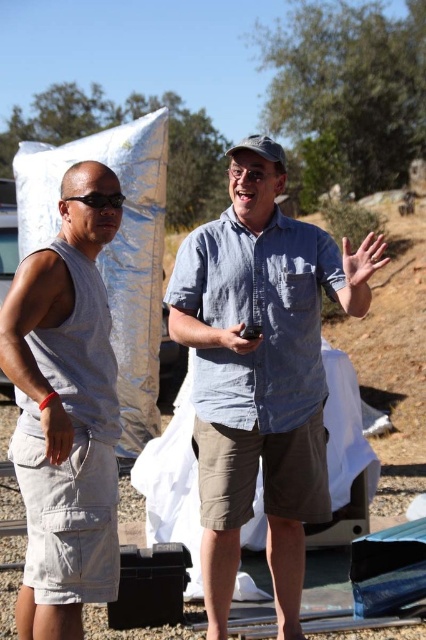
Which of these two, gray cotton tank top at left or matte black phone at center, stands taller?

gray cotton tank top at left

Is point (51, 464) farther from camera compared to point (230, 332)?

No, (51, 464) is closer to viewer.

Does point (83, 368) lie in front of point (259, 337)?

Yes.

Where is `gray cotton tank top at left`? Image resolution: width=426 pixels, height=640 pixels. gray cotton tank top at left is located at coordinates (66, 406).

Is the position of gray cotton tank top at left more distant than that of gray fabric wristband at lower left?

No.

Does gray cotton tank top at left appear over gray fabric wristband at lower left?

Yes.

This screenshot has height=640, width=426. What are the coordinates of `gray cotton tank top at left` in the screenshot? It's located at (66, 406).

Who is more distant from viewer, (287, 342) or (235, 342)?

Positioned behind is point (287, 342).

Does blue linen shirt at center appear on the left side of matte black phone at center?

Incorrect, blue linen shirt at center is not on the left side of matte black phone at center.

Where is `blue linen shirt at center`? This screenshot has height=640, width=426. blue linen shirt at center is located at coordinates (258, 376).